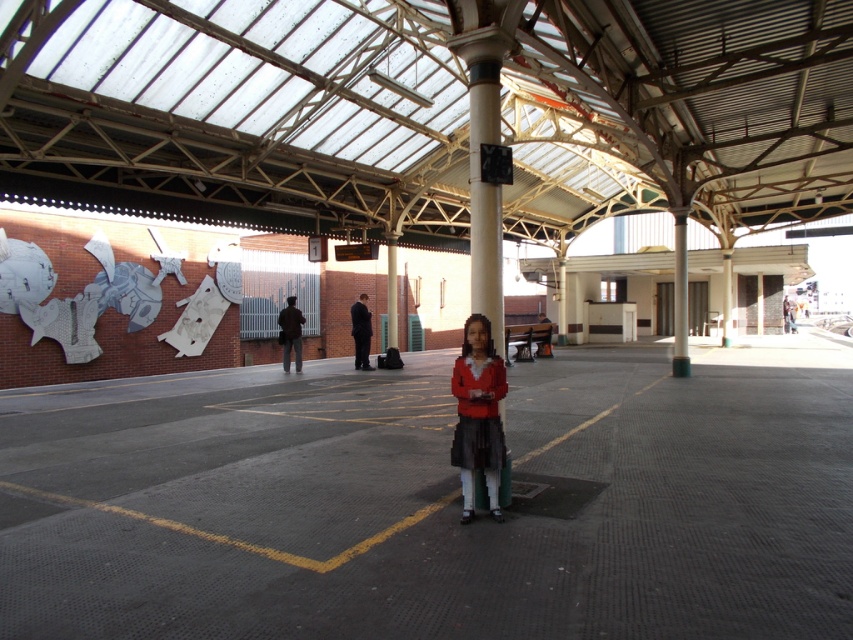
You are standing on the train station platform and see the smooth asphalt parking lot at center and the matte red sweater at center. Which object is located to the right of the other?

The smooth asphalt parking lot at center is to the right of the matte red sweater at center according to the description.